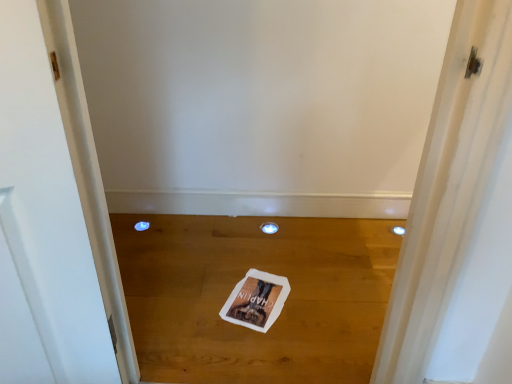
Question: Can you confirm if white paper magazine at center is positioned to the right of blue plastic hole at lower left, the first hole viewed from the left?

Choices:
 (A) yes
 (B) no

Answer: (A)

Question: Would you say white paper magazine at center is outside blue plastic hole at lower left, the second hole when ordered from right to left?

Choices:
 (A) no
 (B) yes

Answer: (B)

Question: Considering the relative positions of white paper magazine at center and blue plastic hole at lower left, the first hole viewed from the left, in the image provided, is white paper magazine at center to the left of blue plastic hole at lower left, the first hole viewed from the left, from the viewer's perspective?

Choices:
 (A) no
 (B) yes

Answer: (A)

Question: From a real-world perspective, does white paper magazine at center sit lower than blue plastic hole at lower left, the second hole when ordered from right to left?

Choices:
 (A) no
 (B) yes

Answer: (A)

Question: Is white paper magazine at center thinner than blue plastic hole at lower left, the first hole viewed from the left?

Choices:
 (A) no
 (B) yes

Answer: (A)

Question: From a real-world perspective, is blue plastic hole at lower left, the second hole when ordered from right to left, physically located above or below white paper magazine at center?

Choices:
 (A) below
 (B) above

Answer: (A)

Question: Is blue plastic hole at lower left, the first hole viewed from the left, wider or thinner than white paper magazine at center?

Choices:
 (A) wide
 (B) thin

Answer: (B)

Question: Considering their positions, is blue plastic hole at lower left, the first hole viewed from the left, located in front of or behind white paper magazine at center?

Choices:
 (A) behind
 (B) front

Answer: (A)

Question: Considering the positions of blue plastic hole at lower left, the first hole viewed from the left, and white paper magazine at center in the image, is blue plastic hole at lower left, the first hole viewed from the left, taller or shorter than white paper magazine at center?

Choices:
 (A) short
 (B) tall

Answer: (B)

Question: In the image, is white paper at center positioned in front of or behind blue plastic hole at lower left, the first hole viewed from the left?

Choices:
 (A) front
 (B) behind

Answer: (A)

Question: In terms of height, does white paper at center look taller or shorter compared to blue plastic hole at lower left, the second hole when ordered from right to left?

Choices:
 (A) tall
 (B) short

Answer: (B)

Question: Considering the positions of point (359, 246) and point (136, 225), is point (359, 246) closer or farther from the camera than point (136, 225)?

Choices:
 (A) farther
 (B) closer

Answer: (B)

Question: In the image, is white paper at center on the left side or the right side of blue plastic hole at lower left, the second hole when ordered from right to left?

Choices:
 (A) left
 (B) right

Answer: (B)

Question: From a real-world perspective, is white paper at center physically located above or below white paper magazine at center?

Choices:
 (A) below
 (B) above

Answer: (A)

Question: Is point (134, 259) closer or farther from the camera than point (263, 301)?

Choices:
 (A) closer
 (B) farther

Answer: (B)